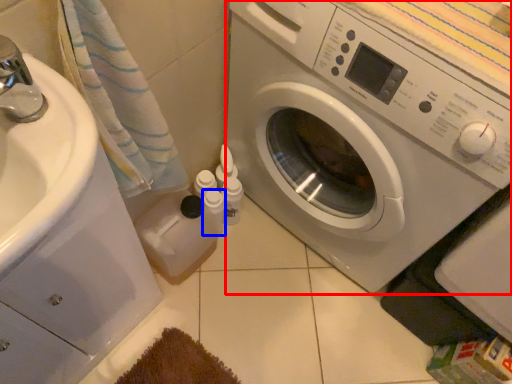
Question: Which object appears farthest to the camera in this image, washing machine (highlighted by a red box) or toiletry (highlighted by a blue box)?

Choices:
 (A) washing machine
 (B) toiletry

Answer: (B)